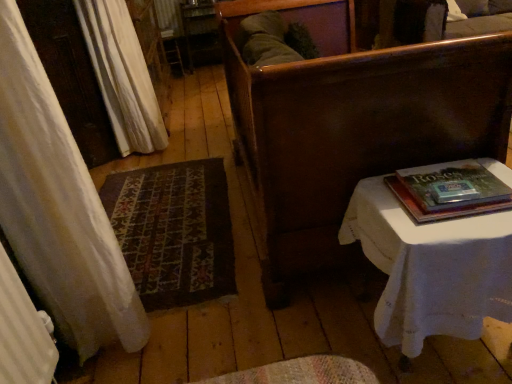
This screenshot has height=384, width=512. I want to click on vacant space in front of hardcover book at right, so click(464, 231).